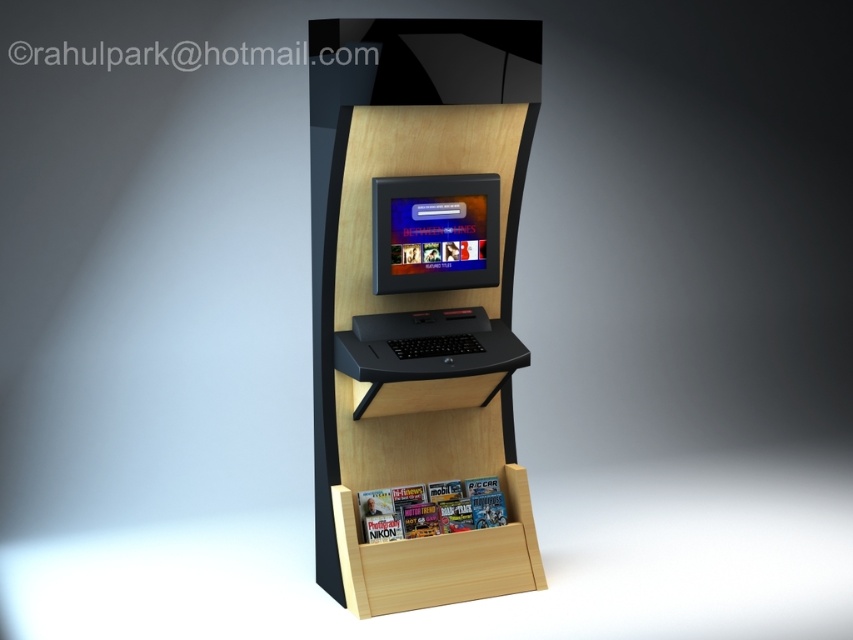
Which is more to the left, matte black laptop at center or black matte laptop at center?

Positioned to the left is black matte laptop at center.

Who is positioned more to the right, matte black laptop at center or black matte laptop at center?

Positioned to the right is matte black laptop at center.

Which is in front, point (474, 221) or point (463, 355)?

Positioned in front is point (463, 355).

Identify the location of matte black laptop at center. The image size is (853, 640). (434, 232).

Who is positioned more to the left, light wood/bookshelf at center or matte black laptop at center?

Positioned to the left is matte black laptop at center.

Is light wood/bookshelf at center below matte black laptop at center?

Correct, light wood/bookshelf at center is located below matte black laptop at center.

Locate an element on the screen. The image size is (853, 640). light wood/bookshelf at center is located at coordinates (410, 410).

How far apart are light wood/bookshelf at center and black matte laptop at center?

light wood/bookshelf at center is 12.73 inches away from black matte laptop at center.

Can you confirm if light wood/bookshelf at center is thinner than black matte laptop at center?

Incorrect, light wood/bookshelf at center's width is not less than black matte laptop at center's.

Is point (354, 564) behind point (368, 358)?

Yes, point (354, 564) is farther from viewer.

This screenshot has width=853, height=640. What are the coordinates of `light wood/bookshelf at center` in the screenshot? It's located at (410, 410).